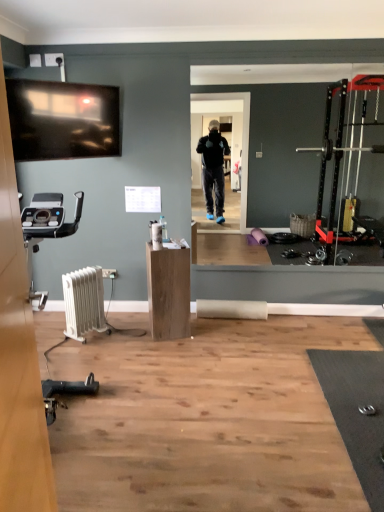
The image size is (384, 512). In order to click on vacant area to the right of wooden cabinet at center in this screenshot , I will do 205,334.